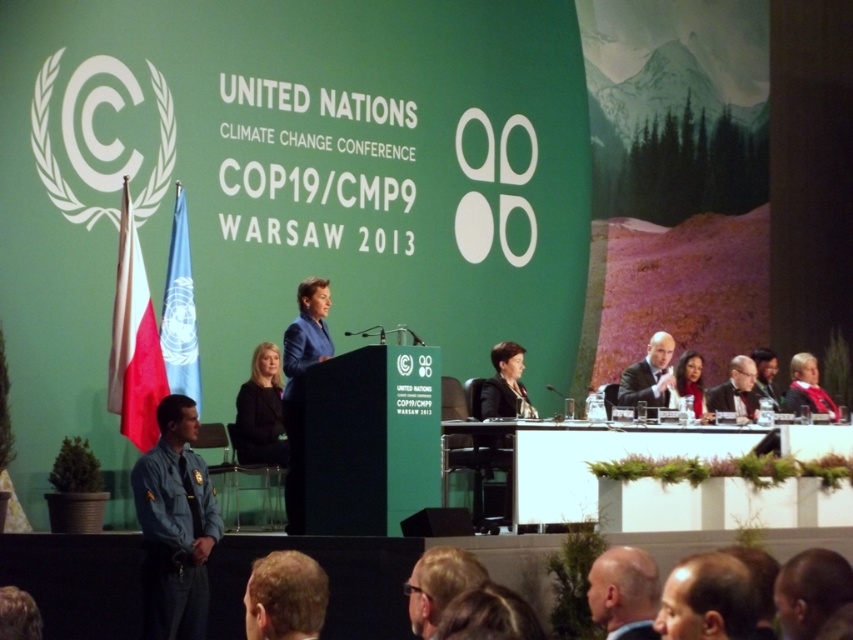
Question: Which object is positioned closest to the red scarf at right?

Choices:
 (A) light blue uniform at left
 (B) smooth skin face at center
 (C) polished white flag at left
 (D) matte black suit at right

Answer: (D)

Question: Which object appears farthest from the camera in this image?

Choices:
 (A) matte black suit at right
 (B) light blue uniform at left
 (C) blue fabric flag at left
 (D) smooth skin face at center

Answer: (A)

Question: Is blue fabric jacket at center further to camera compared to bald head at lower center?

Choices:
 (A) yes
 (B) no

Answer: (A)

Question: Which point is closer to the camera?

Choices:
 (A) red scarf at right
 (B) polished white flag at left
 (C) light blue uniform at left
 (D) dark gray suit at center

Answer: (C)

Question: Is light blue uniform at left wider than dark gray suit at center?

Choices:
 (A) yes
 (B) no

Answer: (B)

Question: Can you confirm if blue fabric jacket at center is thinner than smooth skin face at center?

Choices:
 (A) yes
 (B) no

Answer: (A)